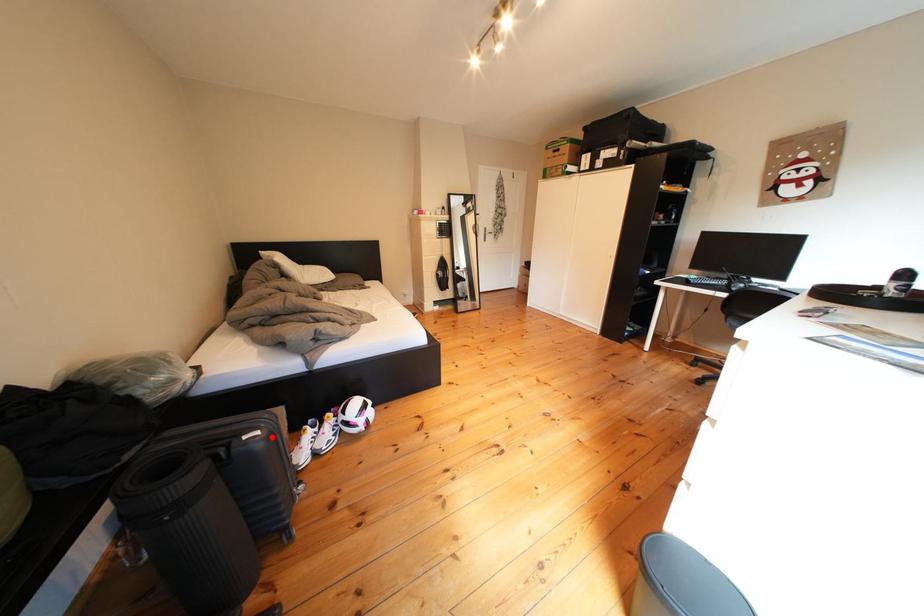
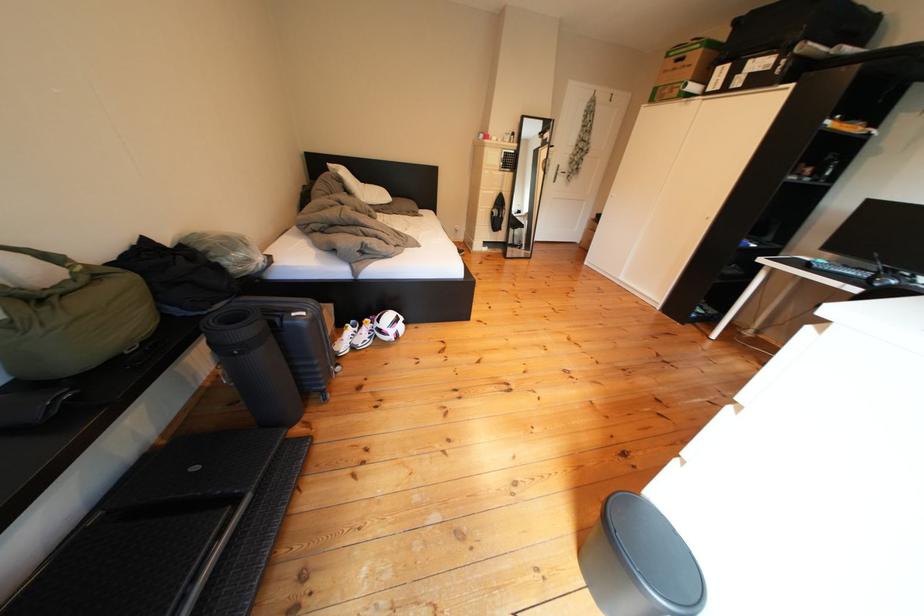
Question: I am providing you with two images of the same scene from different viewpoints. Image1 has a red point marked. In image2, the corresponding 3D location appears at what relative position? Reply with the corresponding letter.

Choices:
 (A) Closer
 (B) Farther

Answer: (B)